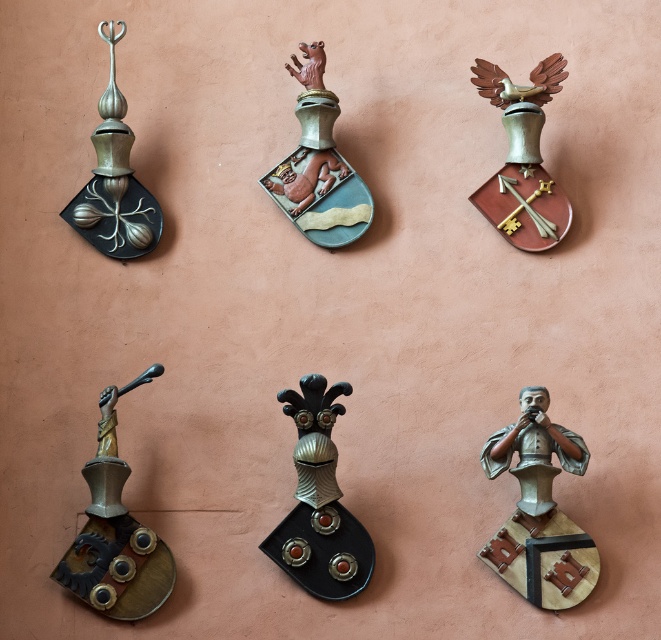
Question: Observing the image, what is the correct spatial positioning of metallic black shield at center in reference to matte green shield with bear at center?

Choices:
 (A) left
 (B) right

Answer: (B)

Question: Estimate the real-world distances between objects in this image. Which object is closer to the bronze metallic bust at center?

Choices:
 (A) matte green shield with bear at center
 (B) matte bronze shield at upper left

Answer: (A)

Question: Which object appears farthest from the camera in this image?

Choices:
 (A) brass/bronze statue at lower left
 (B) polished brass shield with crossed keys at upper right
 (C) matte bronze shield at upper left

Answer: (C)

Question: Based on their relative distances, which object is farther from the polished brass shield with crossed keys at upper right?

Choices:
 (A) brass/bronze statue at lower left
 (B) metallic black shield at center
 (C) matte bronze shield at upper left

Answer: (A)

Question: Does brass/bronze statue at lower left have a larger size compared to polished brass shield with crossed keys at upper right?

Choices:
 (A) yes
 (B) no

Answer: (A)

Question: Is metallic black shield at center positioned at the back of polished brass shield with crossed keys at upper right?

Choices:
 (A) yes
 (B) no

Answer: (B)